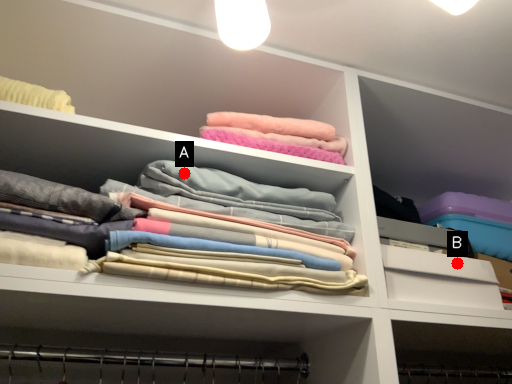
Question: Two points are circled on the image, labeled by A and B beside each circle. Which point is closer to the camera taking this photo?

Choices:
 (A) A is closer
 (B) B is closer

Answer: (A)